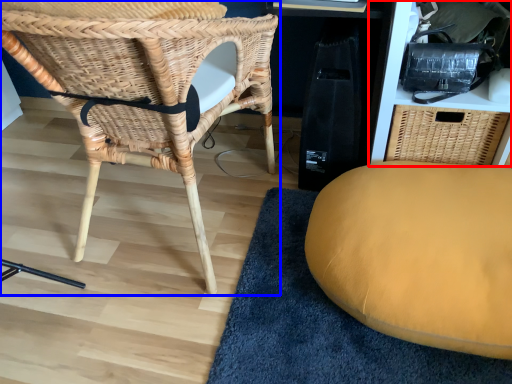
Question: Which object appears closest to the camera in this image, shelf (highlighted by a red box) or chair (highlighted by a blue box)?

Choices:
 (A) shelf
 (B) chair

Answer: (B)